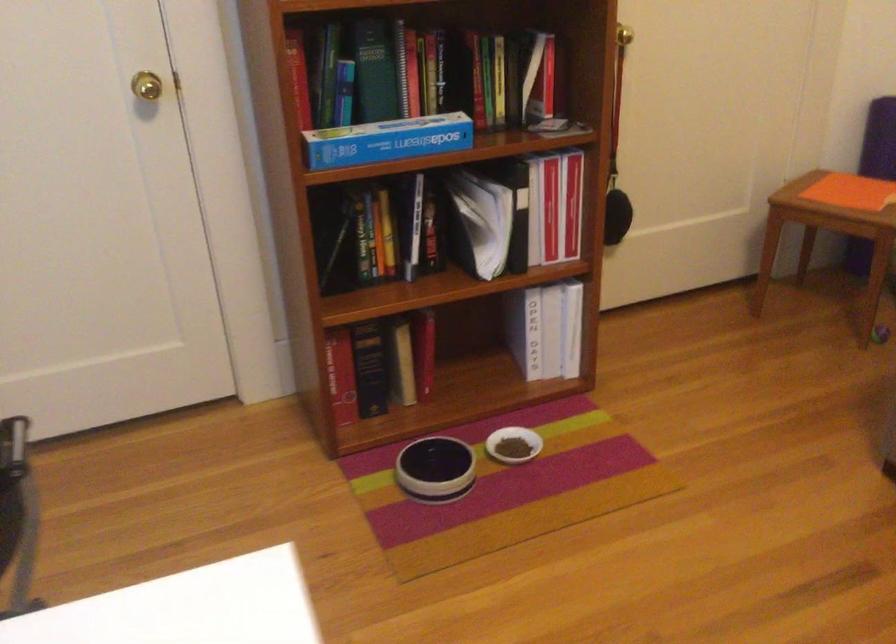
Where would you sit the chair sitting surface? Please return your answer as a coordinate pair (x, y).

(840, 196)